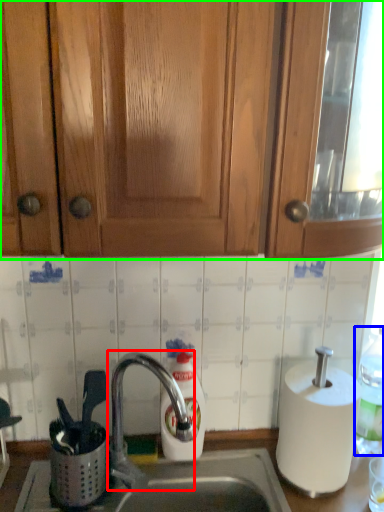
Question: Which object is the closest to the tap (highlighted by a red box)? Choose among these: bottle (highlighted by a blue box) or cabinetry (highlighted by a green box).

Choices:
 (A) bottle
 (B) cabinetry

Answer: (A)